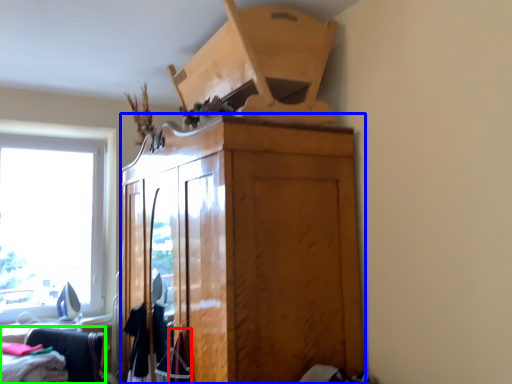
Question: Considering the real-world distances, which object is closest to clothing (highlighted by a red box)? cabinetry (highlighted by a blue box) or furniture (highlighted by a green box).

Choices:
 (A) cabinetry
 (B) furniture

Answer: (A)